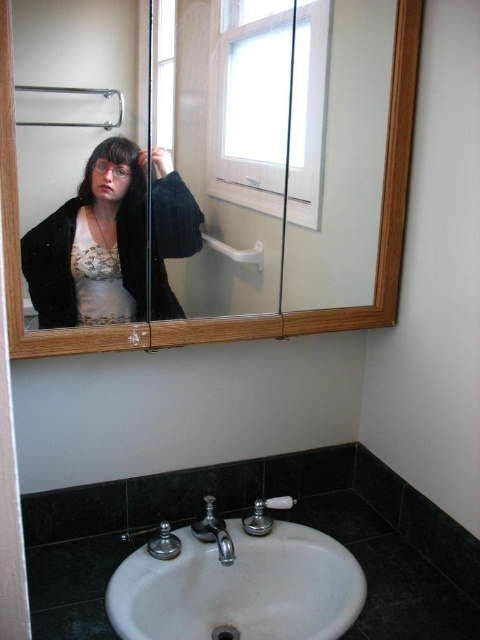
You are a home inspector checking the bathroom. You need to ensure there is enough space between the white glossy sink at lower center and the wooden cabinet at upper center for a 12 inch tall tool box. Is there sufficient space?

The white glossy sink at lower center is 19.89 inches from the wooden cabinet at upper center. Since the tool box is only 12 inches tall, there is enough space between them to accommodate it.

You are standing in front of the bathroom mirror and want to reach a point that is 1.15 meters away from your current position. The point you need to reach is located at coordinates point (197,556). Can you determine if this point is within your reach if your arm can extend up to 1.2 meters?

The distance of point (197,556) from the camera is 1.15 meters. Since your arm can extend up to 1.2 meters, you can reach the point (197,556) as it is within your arm reach.

You are standing in the bathroom and see the white glossy sink at lower center and the matte black sweater at upper left. Which object is located to the right of the other?

The white glossy sink at lower center is positioned on the right side of matte black sweater at upper left.